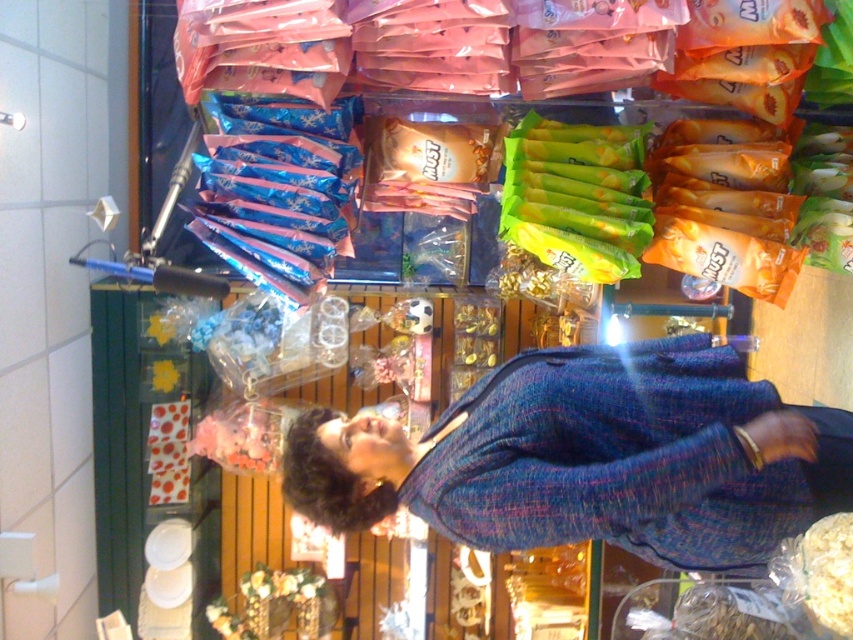
The image size is (853, 640). Describe the element at coordinates (590, 458) in the screenshot. I see `blue tweed jacket at center` at that location.

Which is behind, point (576, 451) or point (575, 234)?

The point (575, 234) is behind.

The width and height of the screenshot is (853, 640). What are the coordinates of `blue tweed jacket at center` in the screenshot? It's located at (590, 458).